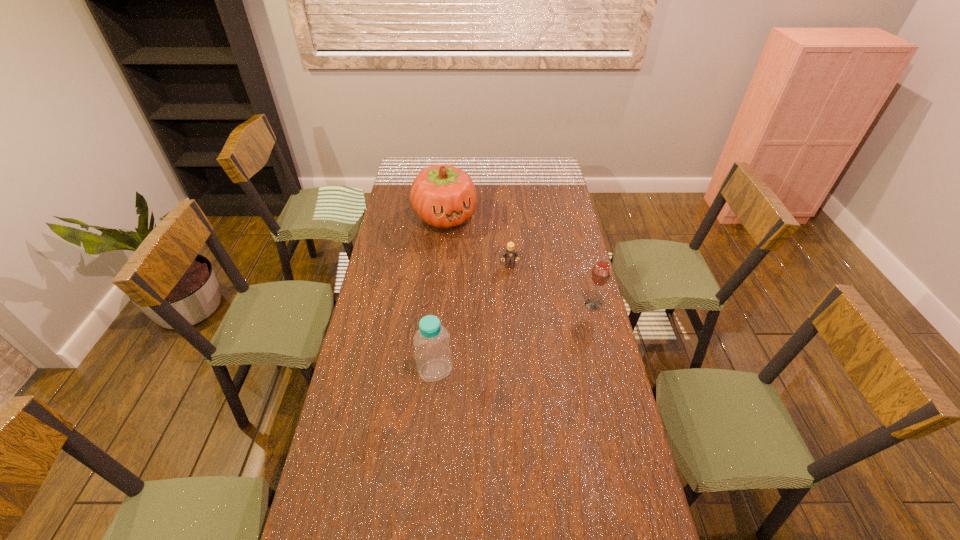
Image resolution: width=960 pixels, height=540 pixels. Identify the location of the nearest object. (433, 356).

Locate an element on the screen. the rightmost object is located at coordinates (600, 275).

Locate an element on the screen. This screenshot has height=540, width=960. the third tallest object is located at coordinates coord(600,275).

Identify the location of pumpkin. (442, 195).

Identify the location of the second farthest object. (509, 254).

Where is `Lego`? Lego is located at coordinates (509, 254).

Locate an element on the screen. free spot located on the left of the bottle is located at coordinates (394, 370).

Where is `free space located 0.060m on the back of the second nearest object`? free space located 0.060m on the back of the second nearest object is located at coordinates (588, 286).

Locate an element on the screen. The image size is (960, 540). free region located 0.360m on the side of the pumpkin with the cute face is located at coordinates (485, 288).

Identify the location of free space located 0.110m on the side of the pumpkin with the cute face. The image size is (960, 540). click(x=464, y=251).